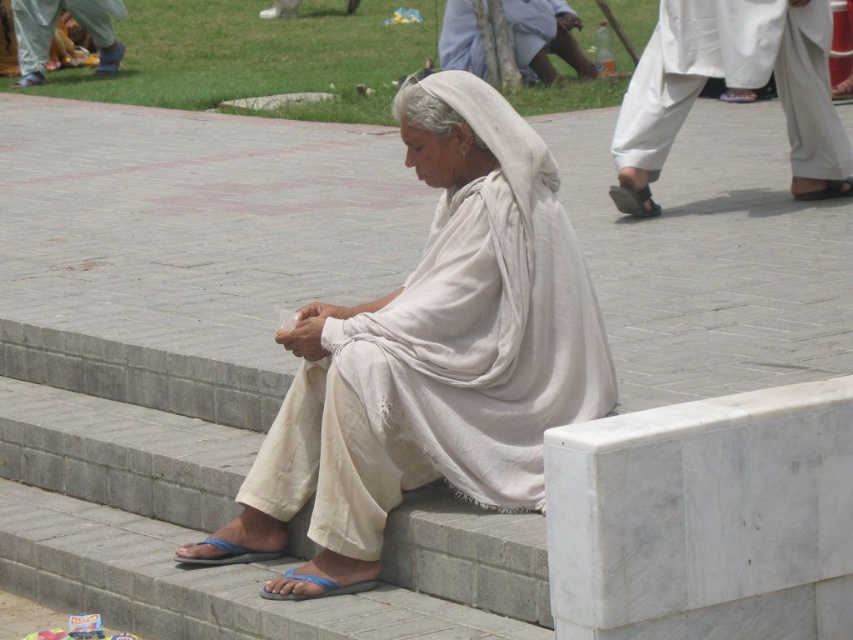
Between white cotton robe at upper left and white cotton robe at upper center, which one is positioned higher?

white cotton robe at upper left

Is white cotton robe at upper left smaller than white cotton robe at upper center?

Actually, white cotton robe at upper left might be larger than white cotton robe at upper center.

Find the location of `white cotton robe at upper left`. white cotton robe at upper left is located at coordinates (55, 28).

In order to click on white cotton robe at upper left in this screenshot , I will do `click(55, 28)`.

Is point (454, 128) positioned in front of point (738, 6)?

Yes, it is in front of point (738, 6).

Who is more distant from viewer, (569,397) or (688,49)?

Point (688,49)

Does point (308, 401) come behind point (711, 10)?

No, (308, 401) is in front of (711, 10).

Locate an element on the screen. light beige fabric shawl at center is located at coordinates (432, 355).

Can you confirm if light beige fabric shawl at center is positioned to the left of white cotton robe at upper center?

Yes, light beige fabric shawl at center is to the left of white cotton robe at upper center.

Does point (474, 118) come behind point (459, 44)?

No.

Does point (502, 125) lie in front of point (444, 36)?

Yes, point (502, 125) is in front of point (444, 36).

The height and width of the screenshot is (640, 853). What are the coordinates of `light beige fabric shawl at center` in the screenshot? It's located at (432, 355).